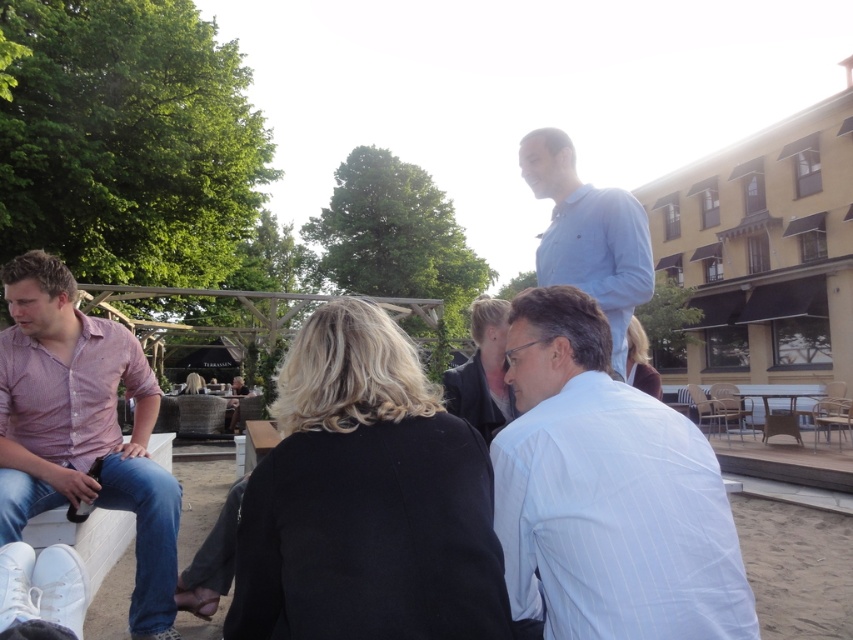
Which is below, pink striped shirt at left or rattan picnic table at lower right?

rattan picnic table at lower right is lower down.

Looking at this image, can you confirm if pink striped shirt at left is bigger than rattan picnic table at lower right?

Result: No.

At what (x,y) coordinates should I click in order to perform the action: click on pink striped shirt at left. Please return your answer as a coordinate pair (x, y). Looking at the image, I should click on (80, 428).

Which is more to the right, light blue shirt at upper center or rattan picnic table at lower right?

From the viewer's perspective, rattan picnic table at lower right appears more on the right side.

Does light blue shirt at upper center have a lesser height compared to rattan picnic table at lower right?

No.

Does point (593, 240) come closer to viewer compared to point (775, 392)?

That is True.

What are the coordinates of `light blue shirt at upper center` in the screenshot? It's located at (589, 234).

Does light blue shirt at upper center have a larger size compared to black leather jacket at center?

Yes, light blue shirt at upper center is bigger than black leather jacket at center.

Does light blue shirt at upper center appear under black leather jacket at center?

Incorrect, light blue shirt at upper center is not positioned below black leather jacket at center.

The width and height of the screenshot is (853, 640). What do you see at coordinates (589, 234) in the screenshot?
I see `light blue shirt at upper center` at bounding box center [589, 234].

Locate an element on the screen. light blue shirt at upper center is located at coordinates (589, 234).